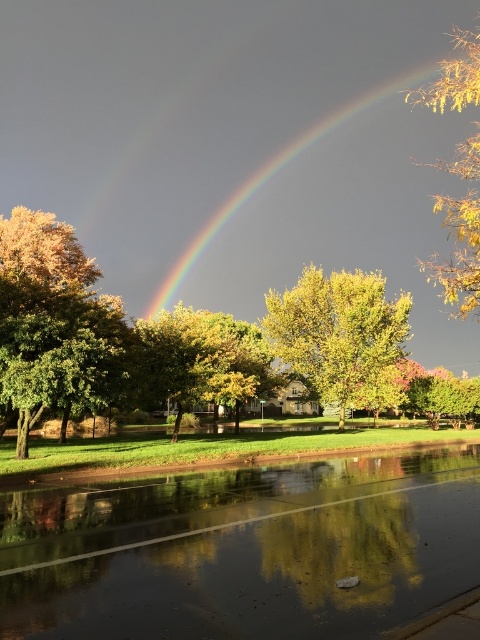
Question: Considering the relative positions of glossy asphalt flood at lower center and rainbow at center in the image provided, where is glossy asphalt flood at lower center located with respect to rainbow at center?

Choices:
 (A) right
 (B) left

Answer: (B)

Question: Which of the following is the farthest from the observer?

Choices:
 (A) (315, 268)
 (B) (0, 611)

Answer: (A)

Question: Is glossy asphalt flood at lower center positioned at the back of yellow leafy tree at upper right?

Choices:
 (A) no
 (B) yes

Answer: (A)

Question: Is glossy asphalt flood at lower center bigger than golden yellow leaves at left?

Choices:
 (A) no
 (B) yes

Answer: (A)

Question: Which object appears farthest from the camera in this image?

Choices:
 (A) yellow leafy tree at upper right
 (B) green leafy tree at center
 (C) glossy asphalt flood at lower center

Answer: (B)

Question: Which point is closer to the camera taking this photo?

Choices:
 (A) (384, 150)
 (B) (320, 540)
 (C) (442, 278)
 (D) (324, 385)

Answer: (B)